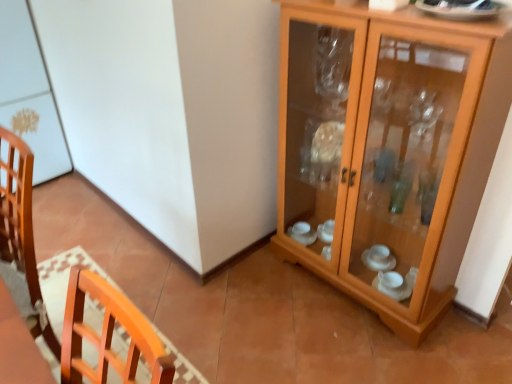
You are a GUI agent. You are given a task and a screenshot of the screen. Output one action in this format:
    pyautogui.click(x=<x>, y=<y>)
    Task: Click on the free space in front of wooden cabinet at right
    
    Given the screenshot: What is the action you would take?
    pyautogui.click(x=365, y=345)